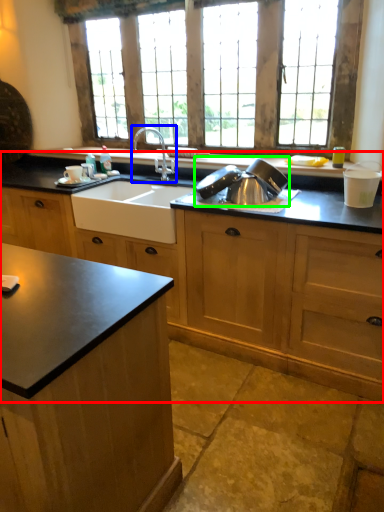
Question: Which object is positioned farthest from cabinetry (highlighted by a red box)? Select from tap (highlighted by a blue box) and appliance (highlighted by a green box).

Choices:
 (A) tap
 (B) appliance

Answer: (A)